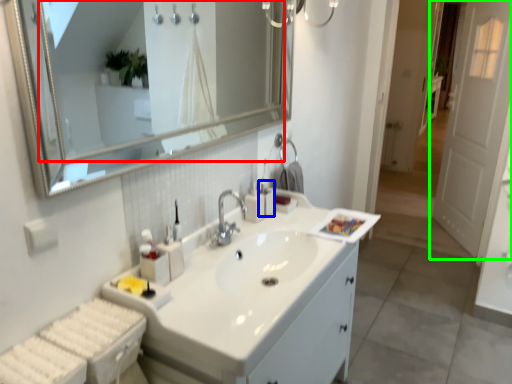
Question: Estimate the real-world distances between objects in this image. Which object is closer to mirror (highlighted by a red box), toiletry (highlighted by a blue box) or door (highlighted by a green box)?

Choices:
 (A) toiletry
 (B) door

Answer: (A)